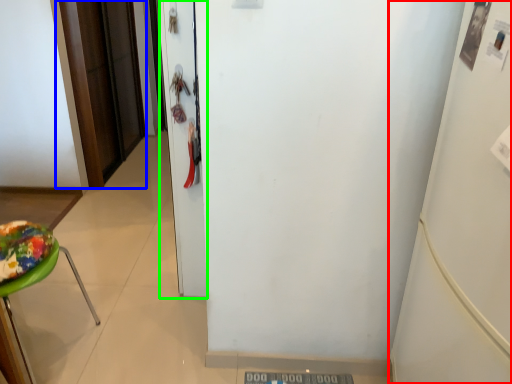
Question: Considering the real-world distances, which object is closest to fridge (highlighted by a red box)? door (highlighted by a blue box) or door (highlighted by a green box).

Choices:
 (A) door
 (B) door

Answer: (B)